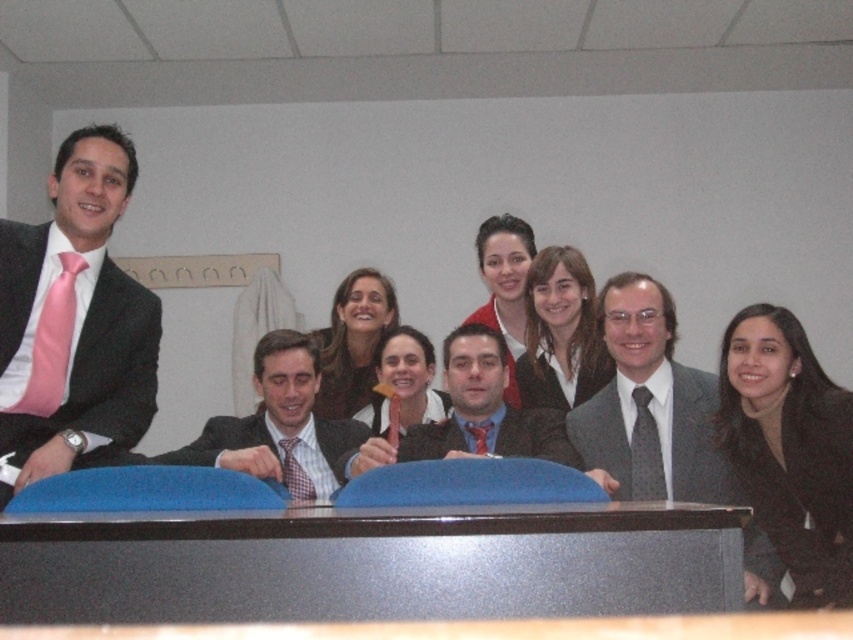
Question: Can you confirm if matte red tie at center is wider than matte black suit at center?

Choices:
 (A) yes
 (B) no

Answer: (B)

Question: Which point is closer to the camera?

Choices:
 (A) matte black suit at center
 (B) black smooth blazer at lower right
 (C) matte white shirt at center
 (D) matte red tie at center

Answer: (B)

Question: Can you confirm if black smooth blazer at lower right is smaller than matte black shirt at center?

Choices:
 (A) yes
 (B) no

Answer: (A)

Question: Which object is the closest to the matte black shirt at center?

Choices:
 (A) striped fabric suit at center
 (B) matte red sweater at center
 (C) smooth black hair at center

Answer: (A)

Question: Does black glossy table at center lie behind black smooth blazer at lower right?

Choices:
 (A) yes
 (B) no

Answer: (B)

Question: Among these objects, which one is nearest to the camera?

Choices:
 (A) matte pink tie at left
 (B) matte red tie at center
 (C) matte white shirt at center
 (D) matte black shirt at center

Answer: (A)